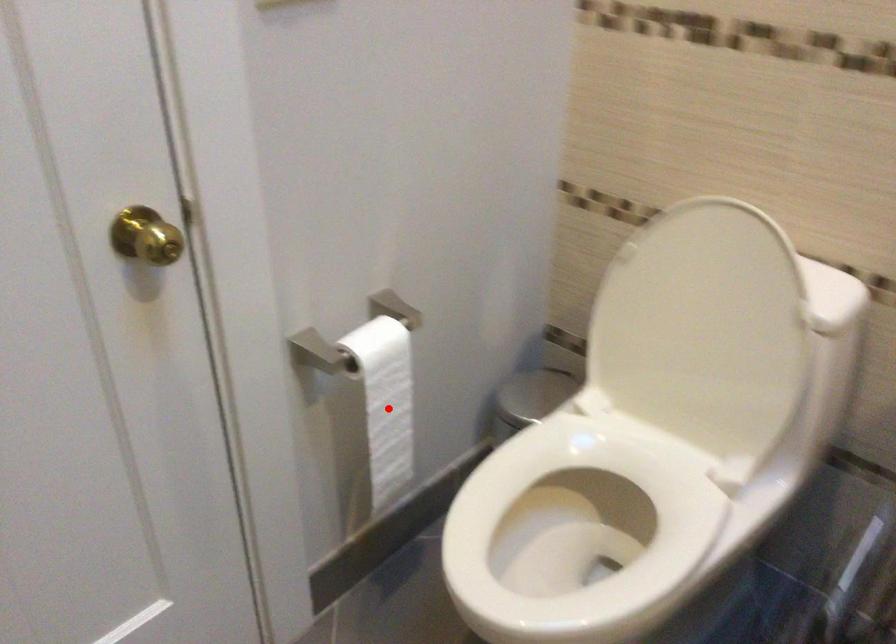
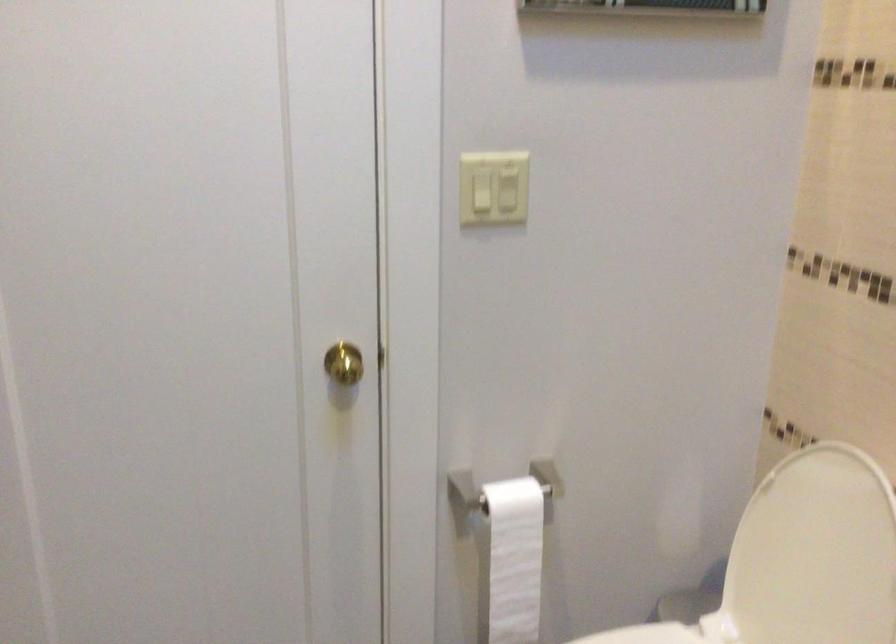
Question: I am providing you with two images of the same scene from different viewpoints. A red point is shown in image1. For the corresponding object point in image2, is it positioned nearer or farther from the camera?

Choices:
 (A) Nearer
 (B) Farther

Answer: (B)